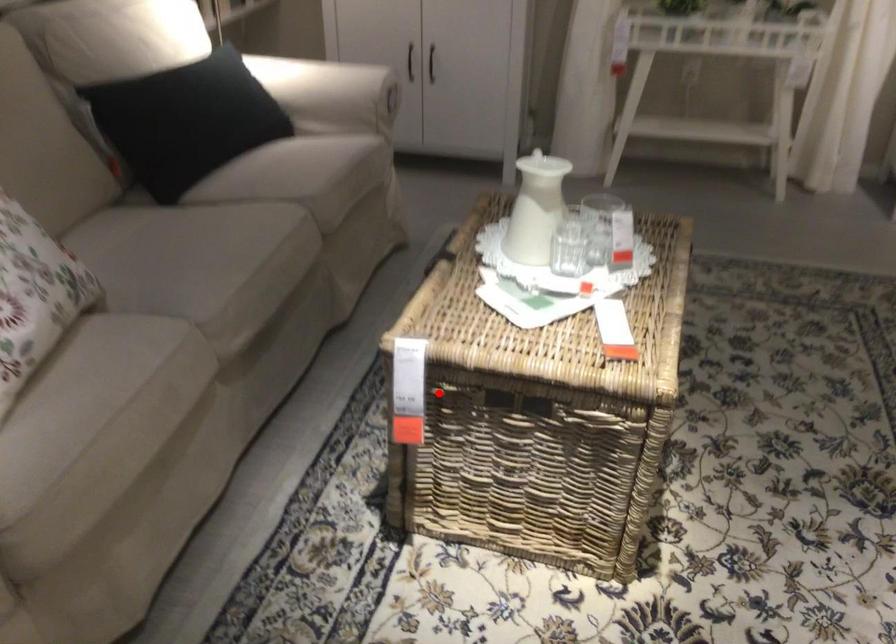
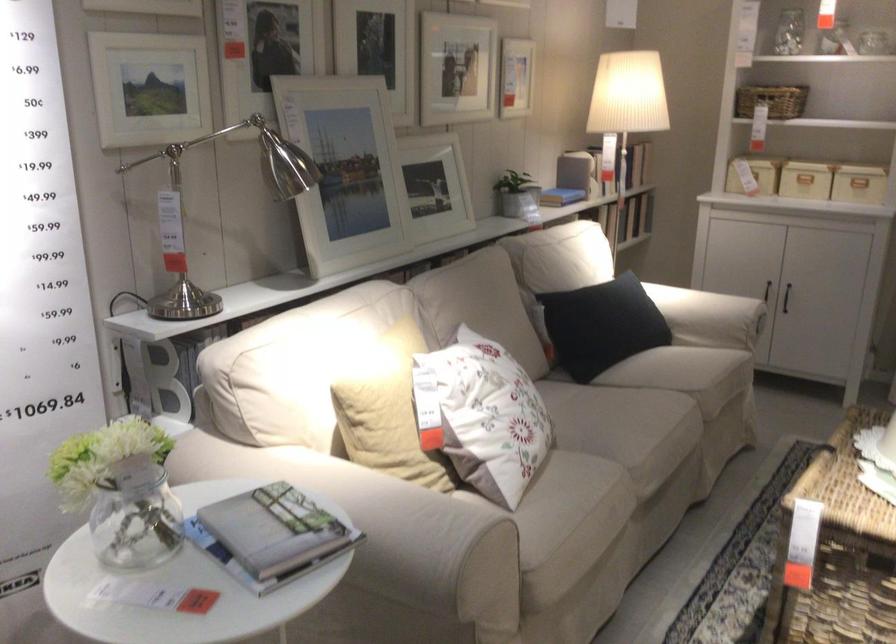
Question: A red point is marked in image1. In image2, is the corresponding 3D point closer to the camera or farther? Reply with the corresponding letter.

Choices:
 (A) The corresponding 3D point is closer.
 (B) The corresponding 3D point is farther.

Answer: (B)